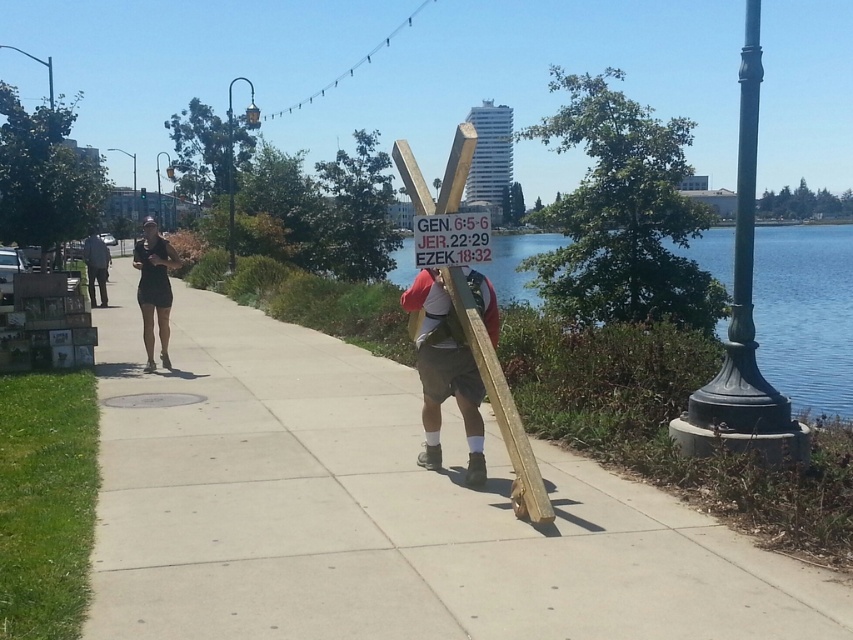
Who is more forward, (x=434, y=392) or (x=106, y=266)?

Point (x=434, y=392)

Is point (445, 324) behind point (100, 305)?

No.

Locate an element on the screen. wooden sign at center is located at coordinates (444, 372).

Measure the distance between smooth concrete sidewalk at center and green cast iron pole at right.

A distance of 13.08 meters exists between smooth concrete sidewalk at center and green cast iron pole at right.

Is point (219, 349) closer to viewer compared to point (743, 323)?

No.

This screenshot has width=853, height=640. Find the location of `smooth concrete sidewalk at center`. smooth concrete sidewalk at center is located at coordinates (381, 509).

Based on the photo, does green cast iron pole at right appear on the left side of white plastic sign at center?

No, green cast iron pole at right is not to the left of white plastic sign at center.

Measure the distance between point (728, 356) and camera.

Point (728, 356) is 6.60 meters from camera.

Identify the location of green cast iron pole at right. (743, 285).